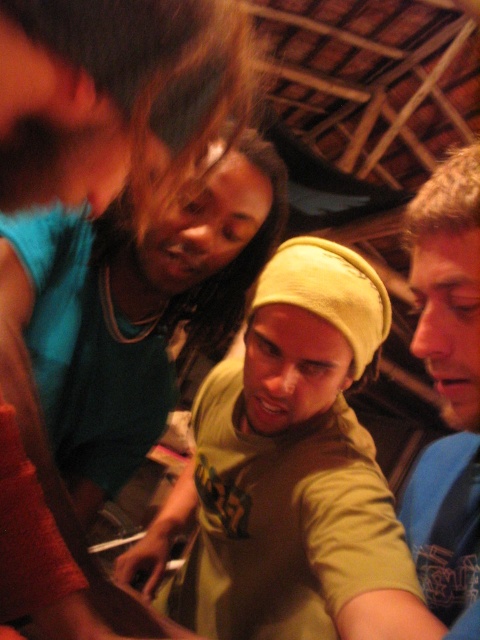
Question: Can you confirm if light green knit cap at center is positioned to the right of blue cotton shirt at right?

Choices:
 (A) yes
 (B) no

Answer: (B)

Question: Is light green knit cap at center smaller than blue cotton shirt at right?

Choices:
 (A) yes
 (B) no

Answer: (B)

Question: Which point is farther to the camera?

Choices:
 (A) blue cotton shirt at right
 (B) light green knit cap at center

Answer: (B)

Question: Which object appears closest to the camera in this image?

Choices:
 (A) light green knit cap at center
 (B) blue cotton shirt at right

Answer: (B)

Question: Is light green knit cap at center to the right of blue cotton shirt at right from the viewer's perspective?

Choices:
 (A) yes
 (B) no

Answer: (B)